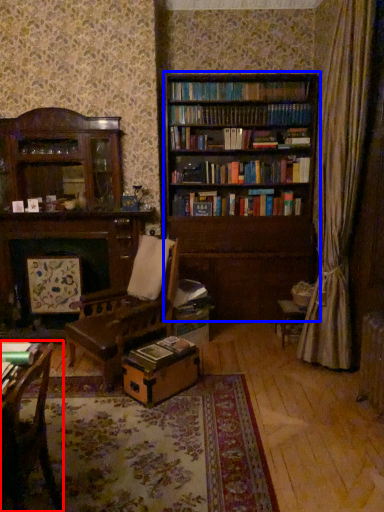
Question: Which object appears closest to the camera in this image, chair (highlighted by a red box) or bookcase (highlighted by a blue box)?

Choices:
 (A) chair
 (B) bookcase

Answer: (A)